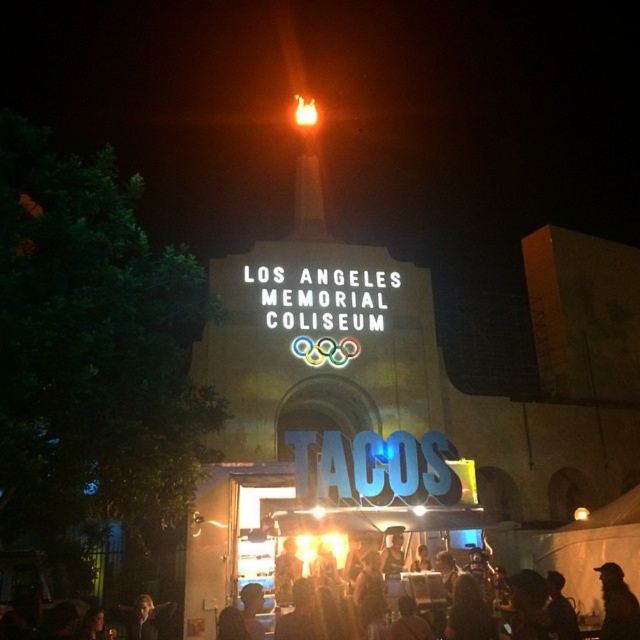
Question: Can you confirm if black matte crowd at lower center is positioned to the left of silhouette fabric at lower right?

Choices:
 (A) no
 (B) yes

Answer: (B)

Question: Which of the following is the farthest from the observer?

Choices:
 (A) (604, 547)
 (B) (620, 632)

Answer: (A)

Question: Is black matte crowd at lower center positioned before silhouette fabric at lower right?

Choices:
 (A) no
 (B) yes

Answer: (A)

Question: Is black matte crowd at lower center bigger than silhouette fabric at lower right?

Choices:
 (A) yes
 (B) no

Answer: (A)

Question: Which point is closer to the camera?

Choices:
 (A) (593, 560)
 (B) (612, 564)

Answer: (B)

Question: Which point is farther to the camera?

Choices:
 (A) (634, 604)
 (B) (572, 548)

Answer: (B)